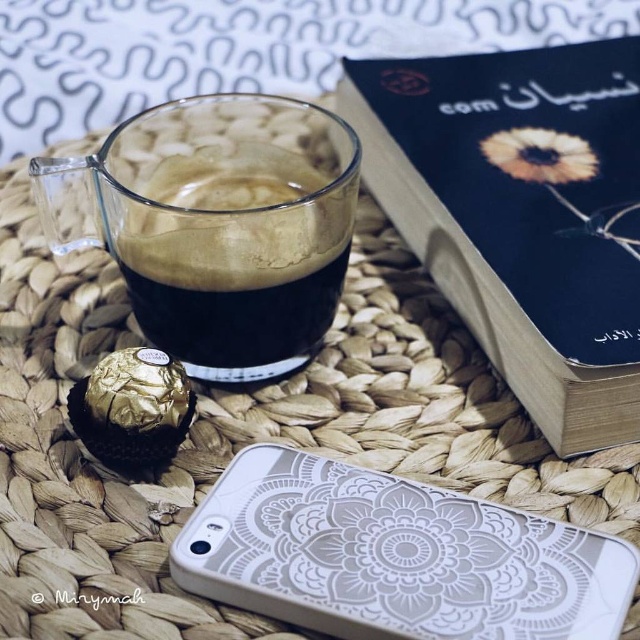
Question: Among these objects, which one is farthest from the camera?

Choices:
 (A) matte black book at upper right
 (B) white textured phone case at lower center

Answer: (A)

Question: Based on their relative distances, which object is nearer to the transparent glass cup at upper left?

Choices:
 (A) white textured phone case at lower center
 (B) matte black book at upper right

Answer: (A)

Question: From the image, what is the correct spatial relationship of matte black book at upper right in relation to transparent glass cup at upper left?

Choices:
 (A) above
 (B) below

Answer: (A)

Question: Among these points, which one is farthest from the camera?

Choices:
 (A) (561, 563)
 (B) (83, 179)
 (C) (460, 188)

Answer: (C)

Question: Is matte black book at upper right to the right of transparent glass cup at upper left from the viewer's perspective?

Choices:
 (A) yes
 (B) no

Answer: (A)

Question: Is matte black book at upper right thinner than white textured phone case at lower center?

Choices:
 (A) no
 (B) yes

Answer: (A)